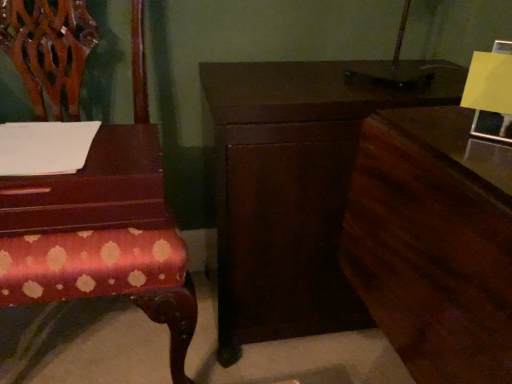
Question: From a real-world perspective, is dark wood nightstand at center above or below polished wood chair at left?

Choices:
 (A) below
 (B) above

Answer: (A)

Question: Does point (228, 175) appear closer or farther from the camera than point (109, 170)?

Choices:
 (A) farther
 (B) closer

Answer: (A)

Question: Estimate the real-world distances between objects in this image. Which object is closer to the mahogany wood table at left?

Choices:
 (A) dark wood dresser at right
 (B) dark wood nightstand at center
 (C) polished wood chair at left

Answer: (C)

Question: Estimate the real-world distances between objects in this image. Which object is farther from the dark wood nightstand at center?

Choices:
 (A) dark wood dresser at right
 (B) mahogany wood table at left
 (C) polished wood chair at left

Answer: (B)